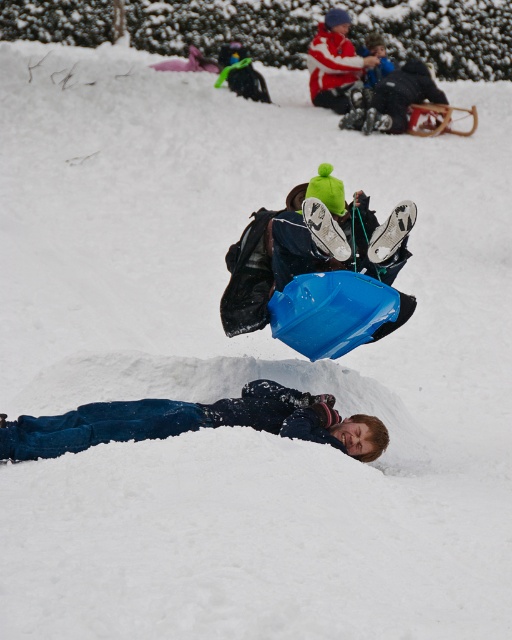
Question: Is blue plastic sled at center smaller than dark blue denim pants at lower center?

Choices:
 (A) no
 (B) yes

Answer: (A)

Question: Among these points, which one is farthest from the camera?

Choices:
 (A) (327, 42)
 (B) (399, 225)
 (C) (268, 426)

Answer: (A)

Question: Where is blue plastic sled at center located in relation to red and white striped sweater at upper center in the image?

Choices:
 (A) left
 (B) right

Answer: (A)

Question: Does blue plastic sled at center have a greater width compared to dark blue denim pants at lower center?

Choices:
 (A) no
 (B) yes

Answer: (A)

Question: Which of these objects is positioned closest to the red and white striped sweater at upper center?

Choices:
 (A) blue plastic sled at center
 (B) dark blue denim pants at lower center

Answer: (A)

Question: Which of these objects is positioned farthest from the red and white striped sweater at upper center?

Choices:
 (A) dark blue denim pants at lower center
 (B) blue plastic sled at center

Answer: (A)